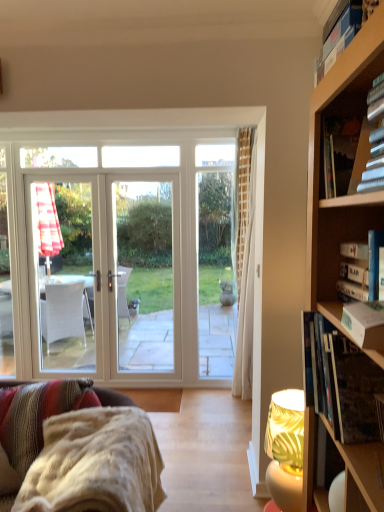
Question: From the image's perspective, is hardcover book at right, the 3th book in the bottom-to-top sequence, on hardcover book at upper right, which ranks as the first book in top-to-bottom order?

Choices:
 (A) no
 (B) yes

Answer: (A)

Question: Is hardcover book at right, marked as the third book in a top-to-bottom arrangement, not near hardcover book at upper right, which ranks as the first book in top-to-bottom order?

Choices:
 (A) no
 (B) yes

Answer: (A)

Question: From the image's perspective, is hardcover book at right, marked as the third book in a top-to-bottom arrangement, below hardcover book at upper right, arranged as the fifth book when ordered from the bottom?

Choices:
 (A) yes
 (B) no

Answer: (A)

Question: Does hardcover book at right, the 3th book in the bottom-to-top sequence, have a smaller size compared to hardcover book at upper right, which ranks as the first book in top-to-bottom order?

Choices:
 (A) no
 (B) yes

Answer: (B)

Question: From a real-world perspective, is hardcover book at right, the 3th book in the bottom-to-top sequence, under hardcover book at upper right, which ranks as the first book in top-to-bottom order?

Choices:
 (A) yes
 (B) no

Answer: (A)

Question: Considering the positions of point (331, 39) and point (352, 189), is point (331, 39) closer or farther from the camera than point (352, 189)?

Choices:
 (A) closer
 (B) farther

Answer: (A)

Question: Choose the correct answer: Is hardcover book at upper right, arranged as the fifth book when ordered from the bottom, inside hardcover book at upper right, which appears as the 4th book when ordered from the bottom, or outside it?

Choices:
 (A) inside
 (B) outside

Answer: (B)

Question: From a real-world perspective, is hardcover book at upper right, arranged as the fifth book when ordered from the bottom, positioned above or below hardcover book at upper right, which appears as the 4th book when ordered from the bottom?

Choices:
 (A) above
 (B) below

Answer: (A)

Question: Is hardcover book at upper right, arranged as the fifth book when ordered from the bottom, bigger or smaller than hardcover book at upper right, marked as the 2th book in a top-to-bottom arrangement?

Choices:
 (A) big
 (B) small

Answer: (A)

Question: From their relative heights in the image, would you say hardcover book at upper right, which ranks as the first book in top-to-bottom order, is taller or shorter than hardcover book at right, marked as the third book in a top-to-bottom arrangement?

Choices:
 (A) tall
 (B) short

Answer: (B)

Question: Is point (342, 10) positioned closer to the camera than point (344, 296)?

Choices:
 (A) closer
 (B) farther

Answer: (A)

Question: In terms of size, does hardcover book at upper right, arranged as the fifth book when ordered from the bottom, appear bigger or smaller than hardcover book at right, marked as the third book in a top-to-bottom arrangement?

Choices:
 (A) small
 (B) big

Answer: (B)

Question: Is hardcover book at upper right, arranged as the fifth book when ordered from the bottom, situated inside hardcover book at right, marked as the third book in a top-to-bottom arrangement, or outside?

Choices:
 (A) outside
 (B) inside

Answer: (A)

Question: Based on their sizes in the image, would you say white textured fabric couch at lower left is bigger or smaller than hardcover book at upper right, which ranks as the first book in top-to-bottom order?

Choices:
 (A) big
 (B) small

Answer: (A)

Question: From the image's perspective, is white textured fabric couch at lower left above or below hardcover book at upper right, arranged as the fifth book when ordered from the bottom?

Choices:
 (A) below
 (B) above

Answer: (A)